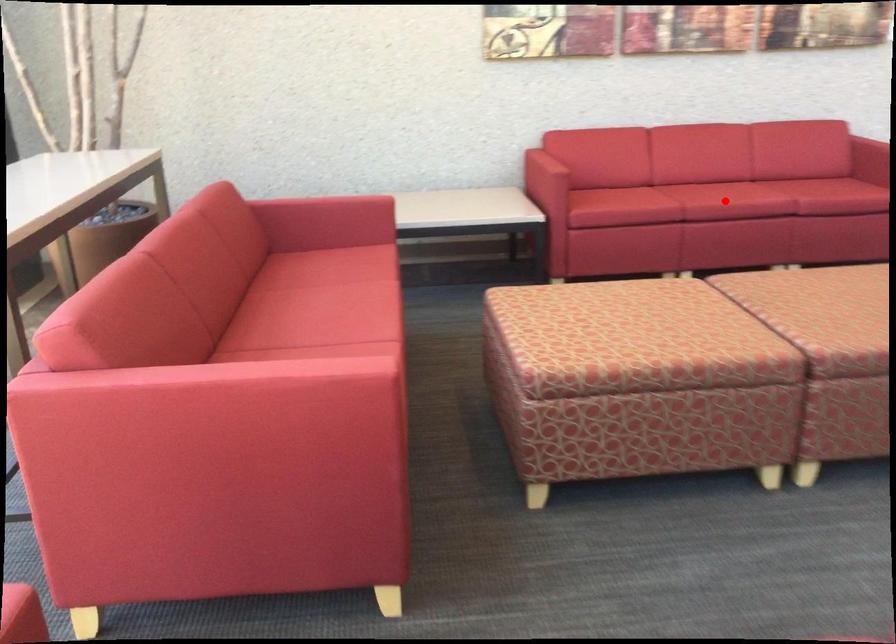
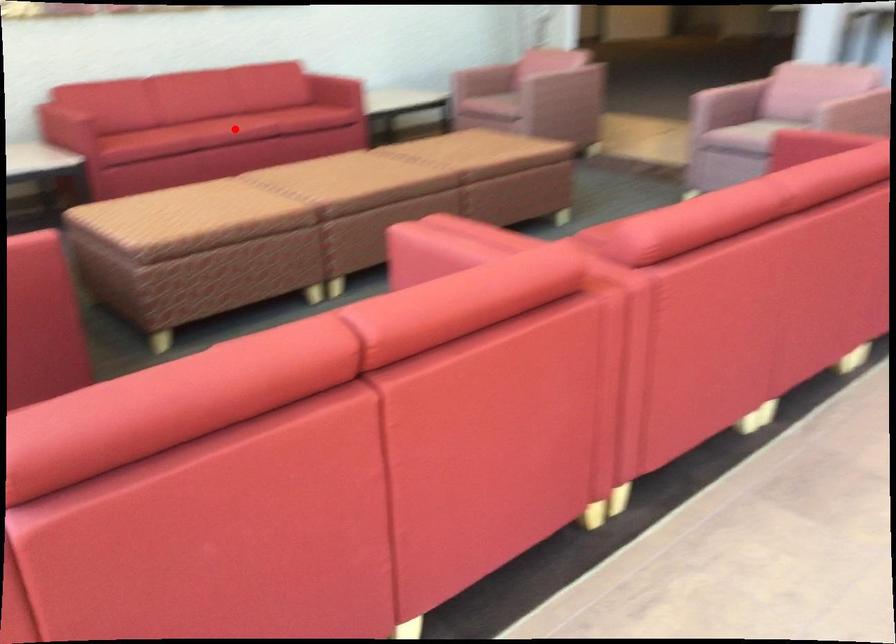
From the picture: I am providing you with two images of the same scene from different viewpoints. A red point is marked on the first image and another point is marked on the second image. Is the marked point in image1 the same physical position as the marked point in image2?

Yes